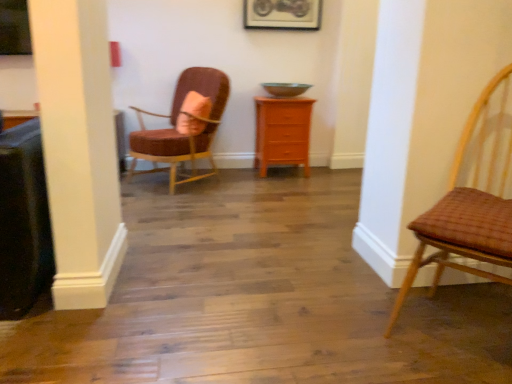
The height and width of the screenshot is (384, 512). What are the coordinates of `vacant space positioned to the left of woven brown chair at right, the first chair when ordered from front to back` in the screenshot? It's located at pyautogui.click(x=341, y=324).